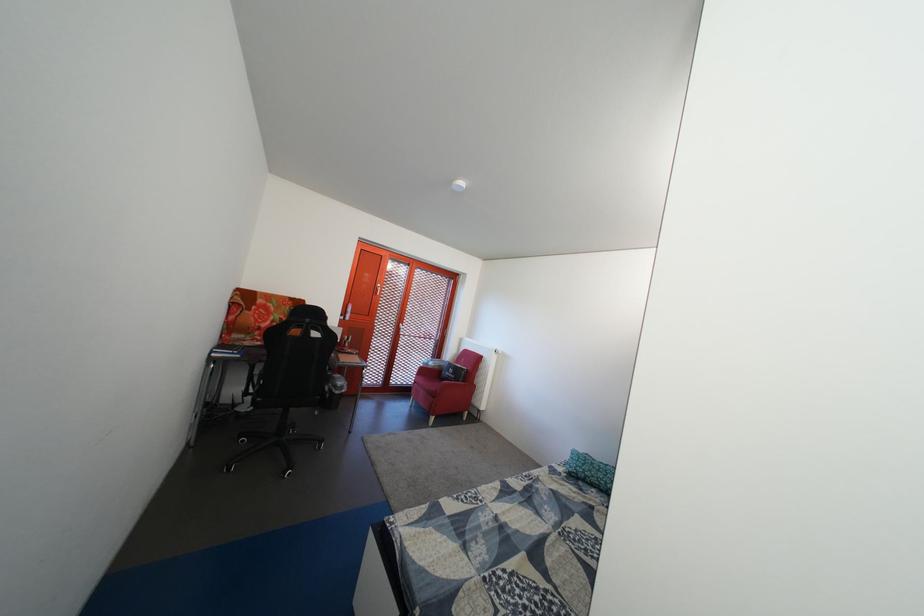
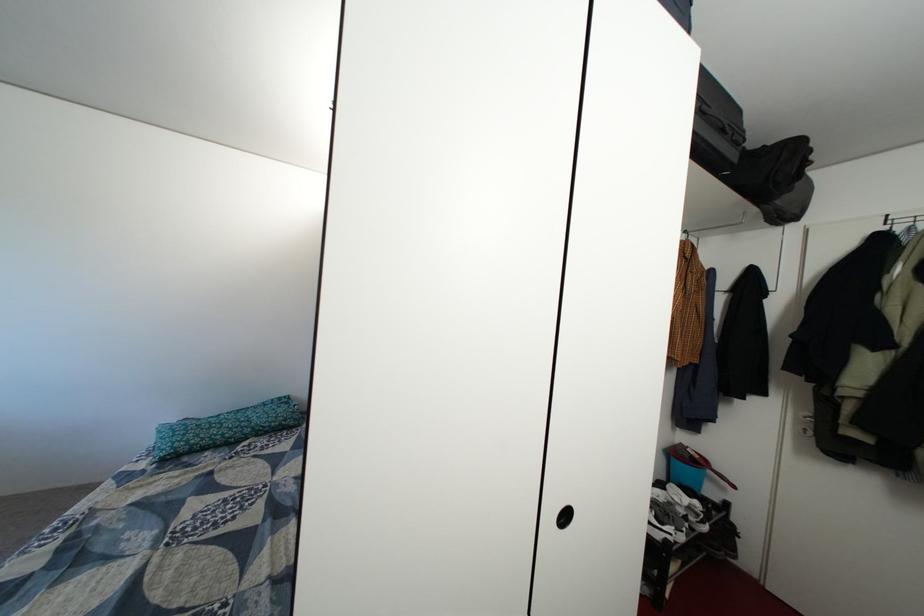
In the second image, find the point that corresponds to (610,477) in the first image.

(222, 435)